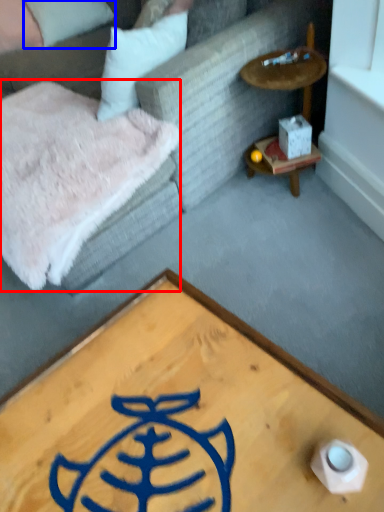
Question: Which object appears closest to the camera in this image, blanket (highlighted by a red box) or pillow (highlighted by a blue box)?

Choices:
 (A) blanket
 (B) pillow

Answer: (A)